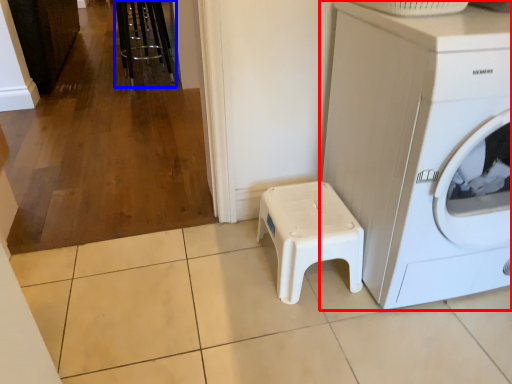
Question: Which object is closer to the camera taking this photo, washing machine (highlighted by a red box) or bar stool (highlighted by a blue box)?

Choices:
 (A) washing machine
 (B) bar stool

Answer: (A)